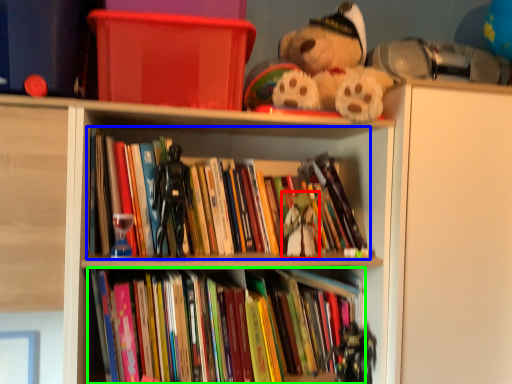
Question: Considering the real-world distances, which object is closest to miniature (highlighted by a red box)? book (highlighted by a blue box) or book (highlighted by a green box).

Choices:
 (A) book
 (B) book

Answer: (A)